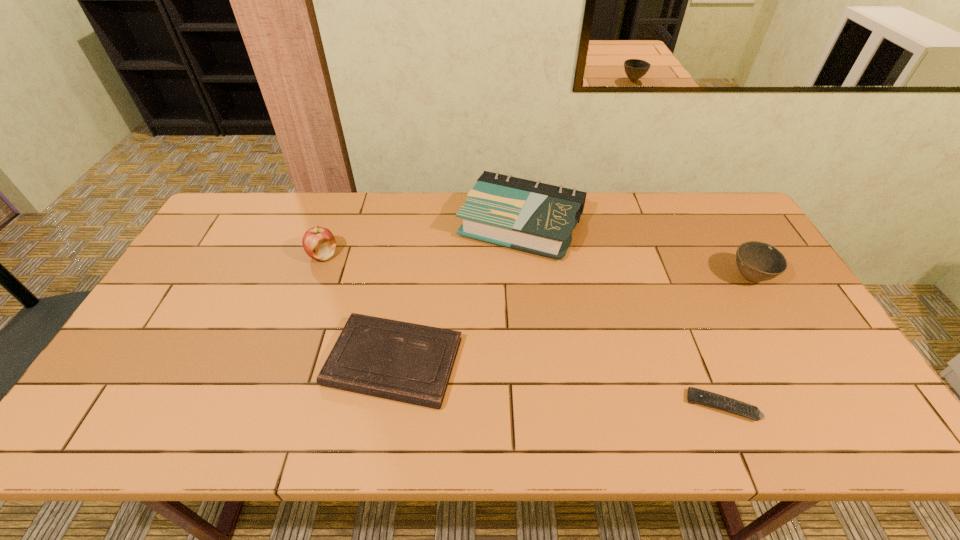
What are the coordinates of `free space between the shorter paperback book and the rightmost object` in the screenshot? It's located at (571, 320).

Locate an element on the screen. object that is the third closest to the farther paperback book is located at coordinates (757, 261).

Identify the location of the third closest object to the farther paperback book. This screenshot has height=540, width=960. (757, 261).

I want to click on vacant space that satisfies the following two spatial constraints: 1. on the back side of the second shortest object; 2. on the left side of the farther paperback book, so click(x=415, y=225).

Identify the location of free spot that satisfies the following two spatial constraints: 1. on the back side of the taller paperback book; 2. on the right side of the shorter paperback book. (415, 225).

Image resolution: width=960 pixels, height=540 pixels. I want to click on vacant point that satisfies the following two spatial constraints: 1. on the front side of the remote control; 2. on the left side of the farther paperback book, so click(540, 406).

Image resolution: width=960 pixels, height=540 pixels. Find the location of `vacant space that satisfies the following two spatial constraints: 1. on the front side of the shortest object; 2. on the right side of the farther paperback book`. vacant space that satisfies the following two spatial constraints: 1. on the front side of the shortest object; 2. on the right side of the farther paperback book is located at coordinates (540, 406).